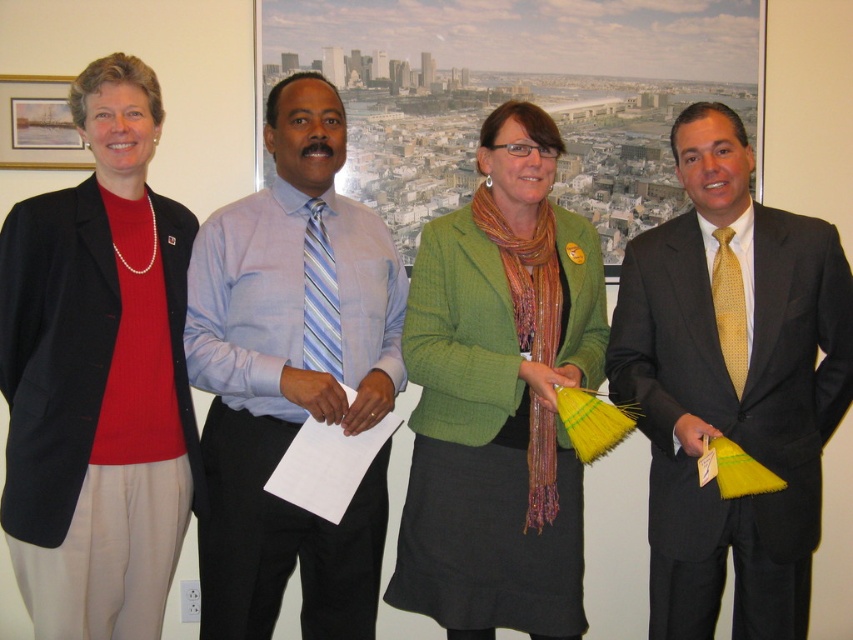
In the image of the group standing in front of a cityscape picture, where is the matte black blazer at left located in terms of coordinates?

The matte black blazer at left is located at point (97, 376).